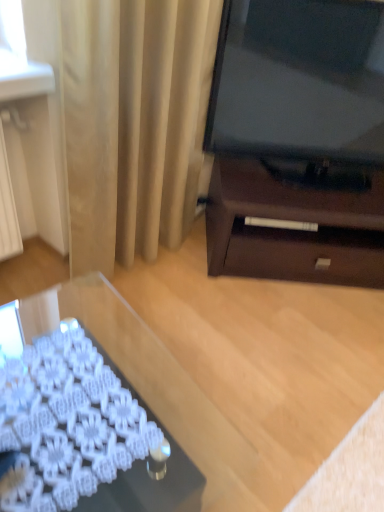
Measure the distance between point (85, 167) and camera.

They are 5.12 feet apart.

Describe the element at coordinates (134, 123) in the screenshot. The image size is (384, 512). I see `beige fabric curtain at upper left` at that location.

Locate an element on the screen. This screenshot has height=512, width=384. beige fabric curtain at upper left is located at coordinates (134, 123).

Find the location of a particular element. The height and width of the screenshot is (512, 384). transparent glass desk at lower left is located at coordinates (81, 422).

Measure the distance between transparent glass desk at lower left and camera.

A distance of 31.19 inches exists between transparent glass desk at lower left and camera.

What do you see at coordinates (81, 422) in the screenshot?
I see `transparent glass desk at lower left` at bounding box center [81, 422].

The width and height of the screenshot is (384, 512). Find the location of `beige fabric curtain at upper left`. beige fabric curtain at upper left is located at coordinates (134, 123).

Considering the relative positions of beige fabric curtain at upper left and transparent glass desk at lower left in the image provided, is beige fabric curtain at upper left to the left or to the right of transparent glass desk at lower left?

beige fabric curtain at upper left is to the right of transparent glass desk at lower left.

Between beige fabric curtain at upper left and transparent glass desk at lower left, which one is positioned behind?

beige fabric curtain at upper left.

Which is less distant, (122, 145) or (26, 355)?

Positioned in front is point (26, 355).

From the image's perspective, is beige fabric curtain at upper left on top of transparent glass desk at lower left?

Indeed, from the image's perspective, beige fabric curtain at upper left is shown above transparent glass desk at lower left.

From a real-world perspective, is beige fabric curtain at upper left on transparent glass desk at lower left?

Yes.

Which of these two, beige fabric curtain at upper left or transparent glass desk at lower left, is thinner?

beige fabric curtain at upper left is thinner.

Can you confirm if beige fabric curtain at upper left is taller than transparent glass desk at lower left?

Yes, beige fabric curtain at upper left is taller than transparent glass desk at lower left.

Is beige fabric curtain at upper left smaller than transparent glass desk at lower left?

Correct, beige fabric curtain at upper left occupies less space than transparent glass desk at lower left.

Would you say beige fabric curtain at upper left is inside or outside transparent glass desk at lower left?

beige fabric curtain at upper left is outside transparent glass desk at lower left.

Are beige fabric curtain at upper left and transparent glass desk at lower left located far from each other?

No.

From the picture: Is beige fabric curtain at upper left facing towards transparent glass desk at lower left?

No, beige fabric curtain at upper left does not turn towards transparent glass desk at lower left.

Identify the location of desk below the beige fabric curtain at upper left (from a real-world perspective). The image size is (384, 512). (81, 422).

Is transparent glass desk at lower left at the left side of beige fabric curtain at upper left?

Yes.

Considering the positions of objects transparent glass desk at lower left and beige fabric curtain at upper left in the image provided, who is in front, transparent glass desk at lower left or beige fabric curtain at upper left?

transparent glass desk at lower left is closer to the camera.

Which is behind, point (97, 472) or point (126, 212)?

The point (126, 212) is farther from the camera.

From the image's perspective, who appears lower, transparent glass desk at lower left or beige fabric curtain at upper left?

transparent glass desk at lower left.

From a real-world perspective, is transparent glass desk at lower left physically below beige fabric curtain at upper left?

Yes, from a real-world perspective, transparent glass desk at lower left is beneath beige fabric curtain at upper left.

Which object is wider, transparent glass desk at lower left or beige fabric curtain at upper left?

Wider between the two is transparent glass desk at lower left.

Which of these two, transparent glass desk at lower left or beige fabric curtain at upper left, stands shorter?

transparent glass desk at lower left.

Is transparent glass desk at lower left bigger than beige fabric curtain at upper left?

Correct, transparent glass desk at lower left is larger in size than beige fabric curtain at upper left.

Which is correct: transparent glass desk at lower left is inside beige fabric curtain at upper left, or outside of it?

The correct answer is: outside.

Is transparent glass desk at lower left in contact with beige fabric curtain at upper left?

No, transparent glass desk at lower left is not next to beige fabric curtain at upper left.

Could you tell me if transparent glass desk at lower left is turned towards beige fabric curtain at upper left?

No, transparent glass desk at lower left is not facing towards beige fabric curtain at upper left.

Can you tell me how much transparent glass desk at lower left and beige fabric curtain at upper left differ in facing direction?

transparent glass desk at lower left and beige fabric curtain at upper left are facing 6.08 degrees away from each other.

Locate an element on the screen. curtain located above the transparent glass desk at lower left (from a real-world perspective) is located at coordinates (134, 123).

The width and height of the screenshot is (384, 512). I want to click on desk located underneath the beige fabric curtain at upper left (from a real-world perspective), so click(81, 422).

This screenshot has height=512, width=384. Find the location of `curtain that appears on the right of transparent glass desk at lower left`. curtain that appears on the right of transparent glass desk at lower left is located at coordinates (134, 123).